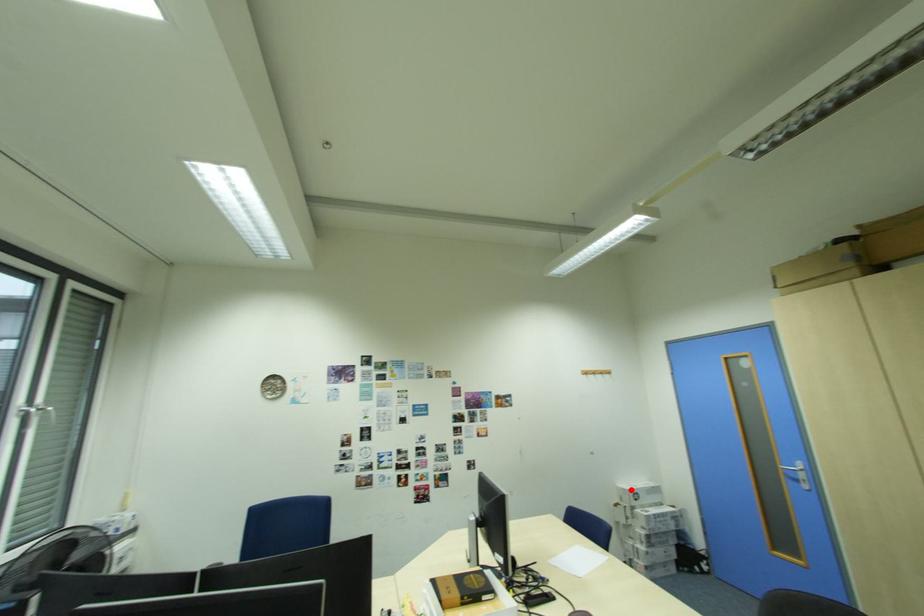
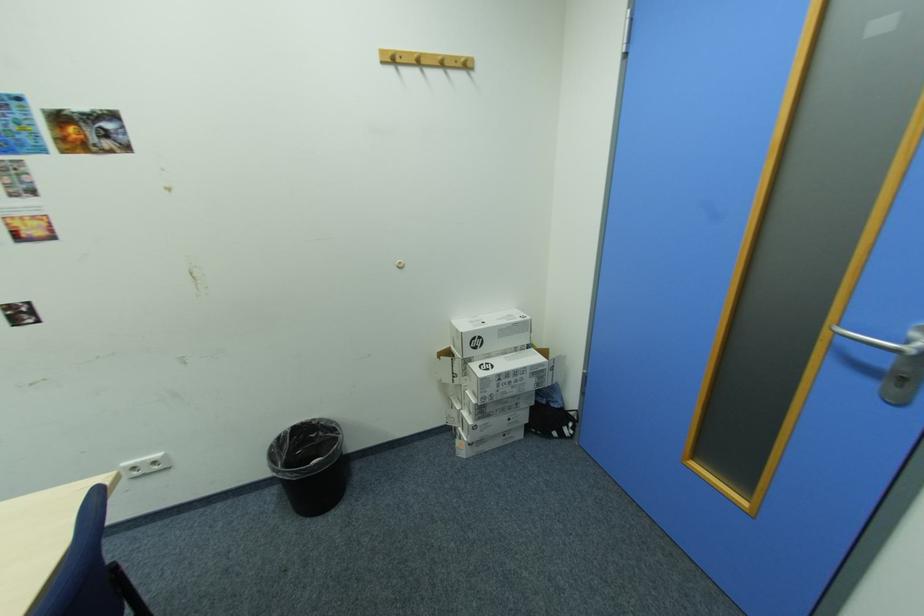
In the second image, find the point that corresponds to the highlighted location in the first image.

(465, 331)